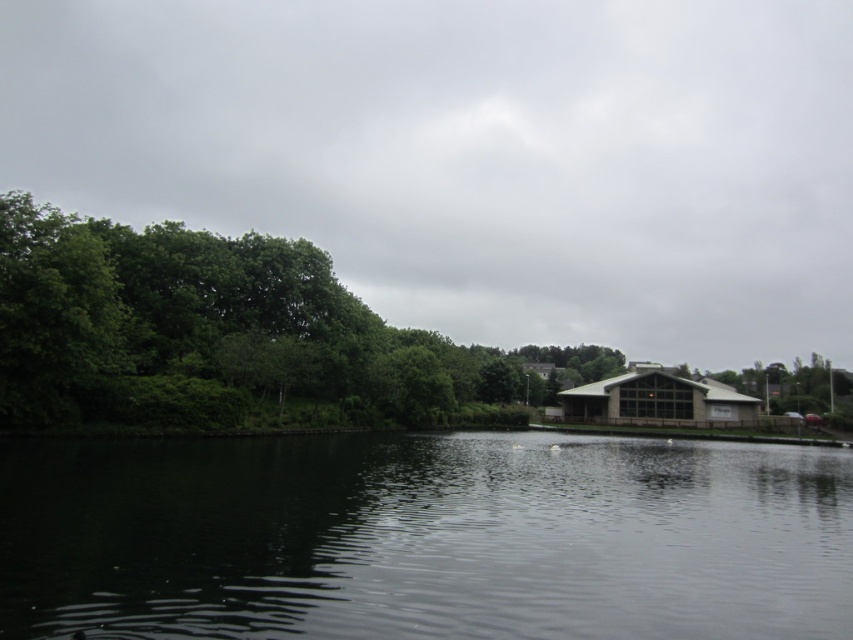
Question: Which of the following is the farthest from the observer?

Choices:
 (A) green leafy trees at left
 (B) dark reflective water at center

Answer: (A)

Question: Does dark reflective water at center appear on the left side of green leafy trees at left?

Choices:
 (A) no
 (B) yes

Answer: (B)

Question: Does dark reflective water at center have a smaller size compared to green leafy trees at left?

Choices:
 (A) yes
 (B) no

Answer: (A)

Question: Is dark reflective water at center closer to the viewer compared to green leafy trees at left?

Choices:
 (A) no
 (B) yes

Answer: (B)